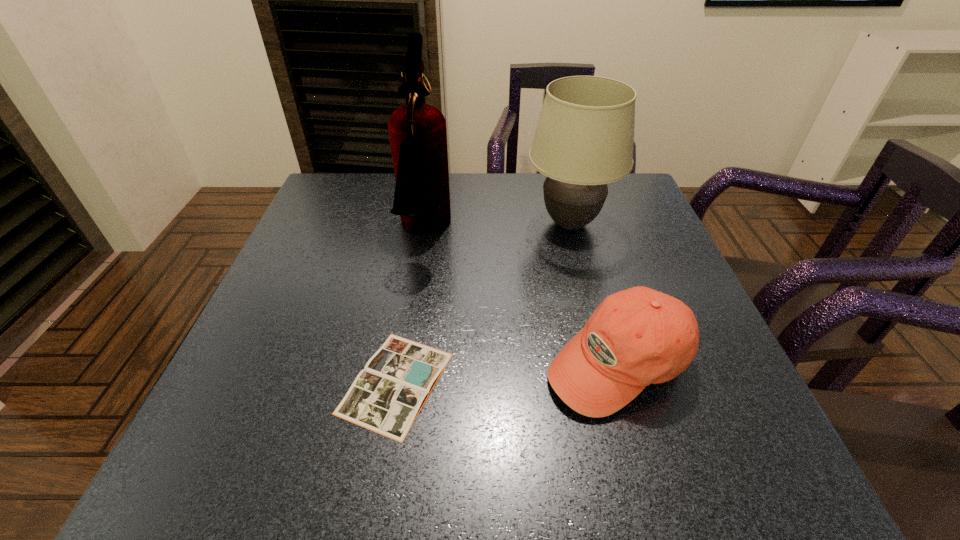
The image size is (960, 540). I want to click on object situated at the near edge, so click(386, 397).

Identify the location of lampshade at the right edge. (584, 139).

Where is `baseball cap located in the right edge section of the desktop`? The height and width of the screenshot is (540, 960). baseball cap located in the right edge section of the desktop is located at coordinates (636, 337).

Locate an element on the screen. This screenshot has height=540, width=960. object that is at the far right corner is located at coordinates (584, 139).

At what (x,y) coordinates should I click in order to perform the action: click on vacant space at the far edge of the desktop. Please return your answer as a coordinate pair (x, y). The height and width of the screenshot is (540, 960). Looking at the image, I should click on (510, 189).

In the image, there is a desktop. Where is `vacant space at the near edge`? This screenshot has height=540, width=960. vacant space at the near edge is located at coordinates (514, 446).

At what (x,y) coordinates should I click in order to perform the action: click on vacant region at the left edge of the desktop. Please return your answer as a coordinate pair (x, y). Looking at the image, I should click on (299, 271).

Identify the location of vacant area at the right edge. The image size is (960, 540). (706, 404).

Identify the location of vacant space at the far left corner. (356, 178).

At what (x,y) coordinates should I click in order to perform the action: click on vacant space at the near left corner of the desktop. Please return your answer as a coordinate pair (x, y). Looking at the image, I should click on (257, 445).